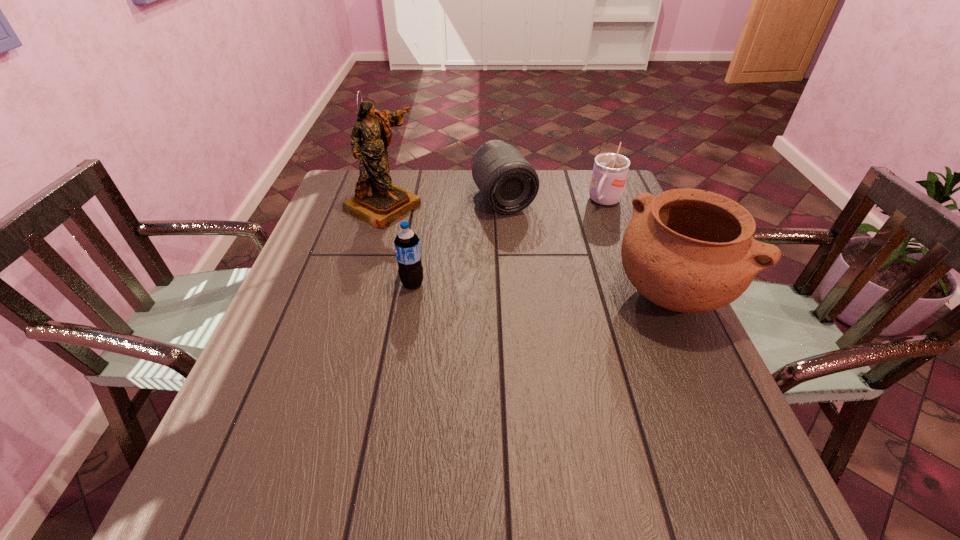
Identify the location of vacant space on the desktop that is between the soda bottle and the pottery and is positioned on the front-facing side of the tallest object. The image size is (960, 540). (533, 288).

You are a GUI agent. You are given a task and a screenshot of the screen. Output one action in this format:
    pyautogui.click(x=<x>, y=<y>)
    Task: Click on the free space on the desktop that is between the soda bottle and the fourth shortest object and is positioned on the surface of the telephoto lens
    
    Given the screenshot: What is the action you would take?
    pyautogui.click(x=561, y=289)

The width and height of the screenshot is (960, 540). I want to click on free space on the desktop that is between the soda bottle and the fourth shortest object and is positioned on the side with the handle of the cup, so click(543, 289).